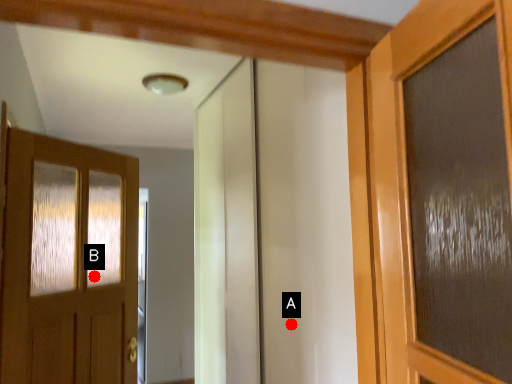
Question: Two points are circled on the image, labeled by A and B beside each circle. Which point is closer to the camera taking this photo?

Choices:
 (A) A is closer
 (B) B is closer

Answer: (A)